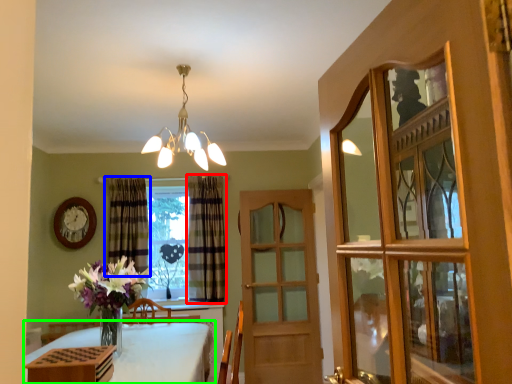
Question: Estimate the real-world distances between objects in this image. Which object is farther from curtain (highlighted by a red box), curtain (highlighted by a blue box) or table (highlighted by a green box)?

Choices:
 (A) curtain
 (B) table

Answer: (B)